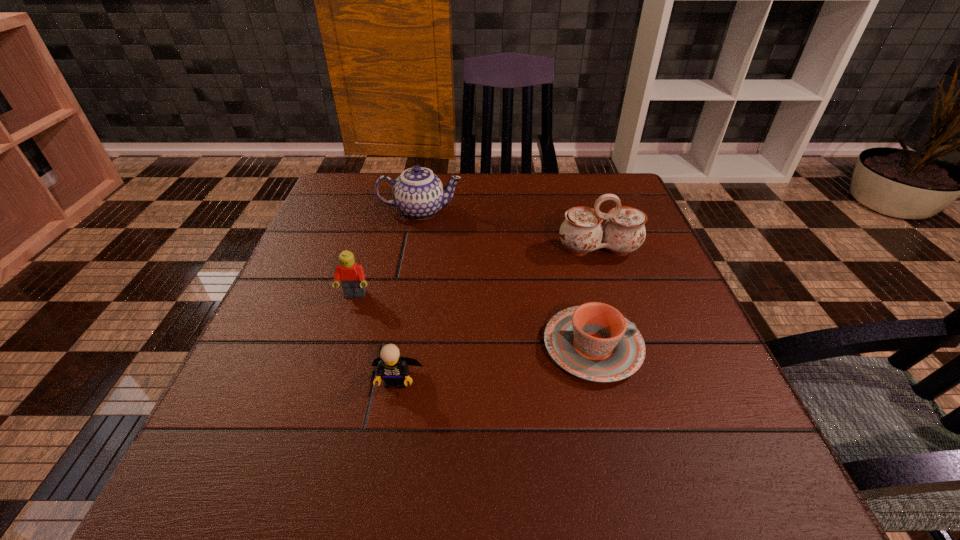
This screenshot has width=960, height=540. I want to click on free region at the right edge, so click(690, 421).

Find the location of a particular element. vacant space at the far left corner of the desktop is located at coordinates (361, 194).

Where is `vacant area at the near left corner`? Image resolution: width=960 pixels, height=540 pixels. vacant area at the near left corner is located at coordinates (303, 468).

This screenshot has height=540, width=960. What are the coordinates of `vacant space at the near right corner of the desktop` in the screenshot? It's located at (775, 507).

You are a GUI agent. You are given a task and a screenshot of the screen. Output one action in this format:
    pyautogui.click(x=<x>, y=<y>)
    Task: Click on the free spot between the farthest object and the third shortest object
    This screenshot has height=540, width=960.
    Given the screenshot: What is the action you would take?
    pyautogui.click(x=388, y=253)

Identify the location of free space that is in between the farthest object and the farther Lego. The height and width of the screenshot is (540, 960). (388, 253).

You are a GUI agent. You are given a task and a screenshot of the screen. Output one action in this format:
    pyautogui.click(x=<x>, y=<y>)
    Task: Click on the free area in between the farther Lego and the fourth nearest object
    This screenshot has height=540, width=960.
    Given the screenshot: What is the action you would take?
    pyautogui.click(x=477, y=273)

Identify the location of free space between the farthest object and the fourth nearest object. This screenshot has width=960, height=540. 510,231.

Locate an element on the screen. The height and width of the screenshot is (540, 960). unoccupied area between the nearer Lego and the left Lego is located at coordinates (375, 338).

Identify the location of free space between the second shortest object and the taller Lego. (375, 338).